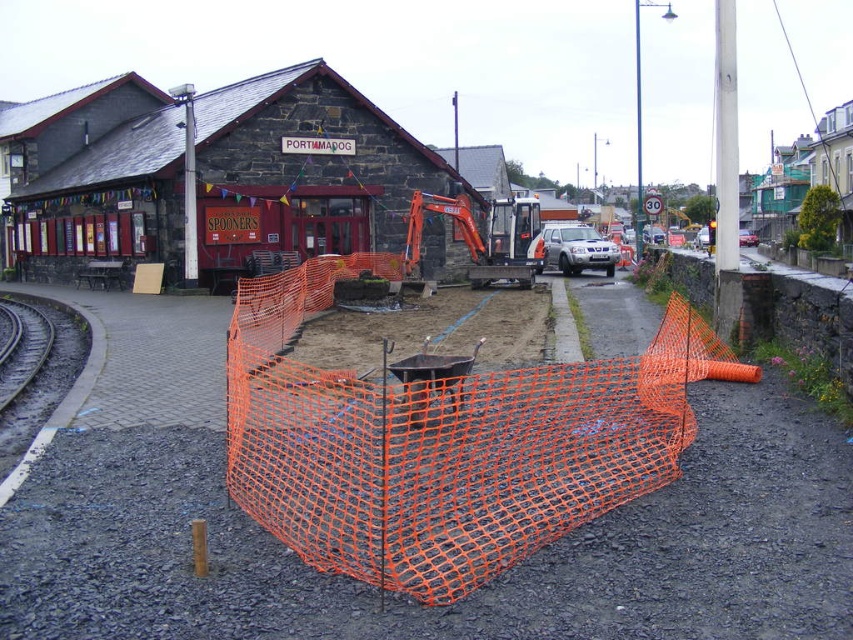
You are a pedestrian standing in front of the construction area. You see the orange mesh fence at center and the stone textured building at upper left. Which object is nearer to you?

The orange mesh fence at center is closer to the viewer than the stone textured building at upper left.